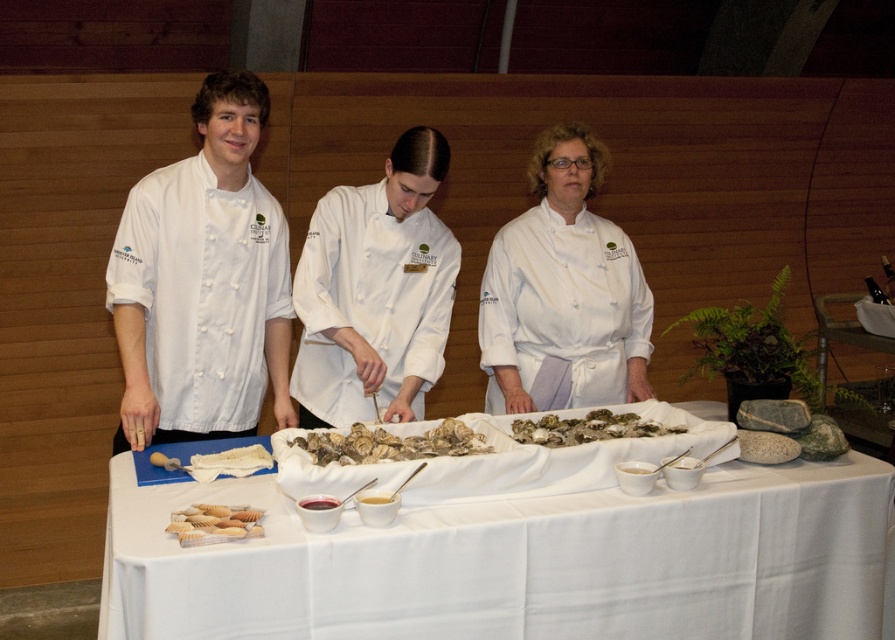
You are organizing a cooking class and need to ensure that all chef uniforms fit properly. You have a participant who is 1.8 meters tall. Based on the image provided, which uniform would you recommend for them, the white matte uniform at left or the white matte chef coat at center?

The white matte chef coat at center is wider than the white matte uniform at left, so it would be more suitable for a participant who is 1.8 meters tall.

You are a guest at a cooking event and want to know which chef is closer to you. The chefs are wearing the white matte uniform at left and the white matte chef coat at center. Based on their positions, which one is positioned higher up in the image?

The white matte uniform at left is positioned higher up in the image than the white matte chef coat at center, so the chef in the white matte uniform at left is closer to you.